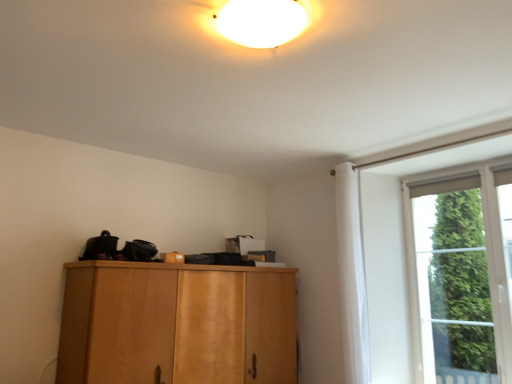
Question: Is light brown wood cabinet at center in front of white fabric curtain at right?

Choices:
 (A) no
 (B) yes

Answer: (B)

Question: Is light brown wood cabinet at center with white fabric curtain at right?

Choices:
 (A) yes
 (B) no

Answer: (B)

Question: Does light brown wood cabinet at center appear on the right side of white fabric curtain at right?

Choices:
 (A) yes
 (B) no

Answer: (B)

Question: Is light brown wood cabinet at center oriented towards white fabric curtain at right?

Choices:
 (A) no
 (B) yes

Answer: (B)

Question: From the image's perspective, is light brown wood cabinet at center on top of white fabric curtain at right?

Choices:
 (A) no
 (B) yes

Answer: (A)

Question: Can you confirm if light brown wood cabinet at center is wider than white fabric curtain at right?

Choices:
 (A) no
 (B) yes

Answer: (B)

Question: Can you confirm if white fabric curtain at right is bigger than light brown wood cabinet at center?

Choices:
 (A) yes
 (B) no

Answer: (B)

Question: Is white fabric curtain at right next to light brown wood cabinet at center?

Choices:
 (A) yes
 (B) no

Answer: (B)

Question: From the image's perspective, is white fabric curtain at right on light brown wood cabinet at center?

Choices:
 (A) no
 (B) yes

Answer: (B)

Question: Is white fabric curtain at right smaller than light brown wood cabinet at center?

Choices:
 (A) no
 (B) yes

Answer: (B)

Question: Would you say white fabric curtain at right is a long distance from light brown wood cabinet at center?

Choices:
 (A) yes
 (B) no

Answer: (A)

Question: Is white fabric curtain at right turned away from light brown wood cabinet at center?

Choices:
 (A) yes
 (B) no

Answer: (B)

Question: Is green glass window at right completely or partially inside light brown wood cabinet at center?

Choices:
 (A) yes
 (B) no

Answer: (B)